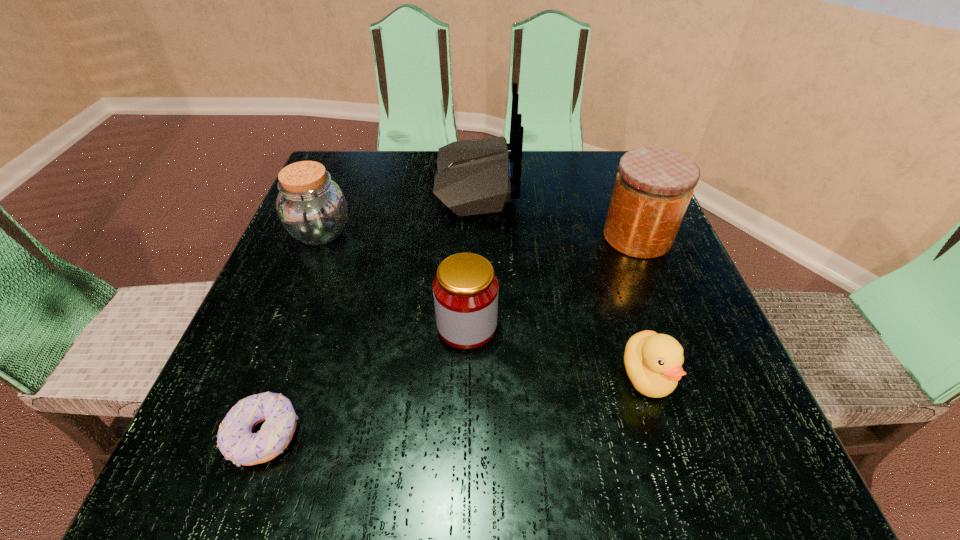
I want to click on free region located on the back of the shortest object, so click(287, 373).

The height and width of the screenshot is (540, 960). Find the location of `object present at the far edge`. object present at the far edge is located at coordinates (473, 177).

Where is `object that is at the near edge`? object that is at the near edge is located at coordinates (237, 442).

You are a GUI agent. You are given a task and a screenshot of the screen. Output one action in this format:
    pyautogui.click(x=<x>, y=<y>)
    Task: Click on the jar located at the left edge
    The width and height of the screenshot is (960, 540).
    Given the screenshot: What is the action you would take?
    311,207

In order to click on doughnut that is at the left edge in this screenshot , I will do `click(237, 442)`.

What are the coordinates of `jar that is at the right edge` in the screenshot? It's located at (653, 188).

This screenshot has height=540, width=960. In order to click on duckling located in the right edge section of the desktop in this screenshot , I will do [x=653, y=362].

Locate an element on the screen. object at the near left corner is located at coordinates (237, 442).

In the image, there is a desktop. At what (x,y) coordinates should I click in order to perform the action: click on vacant space at the far edge. Please return your answer as a coordinate pair (x, y). The height and width of the screenshot is (540, 960). Looking at the image, I should click on (416, 173).

In the image, there is a desktop. Where is `vacant space at the near edge`? The width and height of the screenshot is (960, 540). vacant space at the near edge is located at coordinates (376, 448).